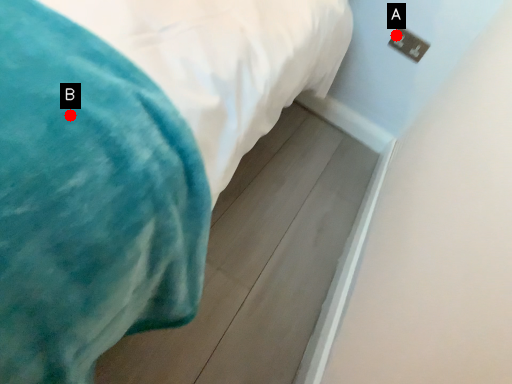
Question: Two points are circled on the image, labeled by A and B beside each circle. Which point is closer to the camera?

Choices:
 (A) A is closer
 (B) B is closer

Answer: (B)